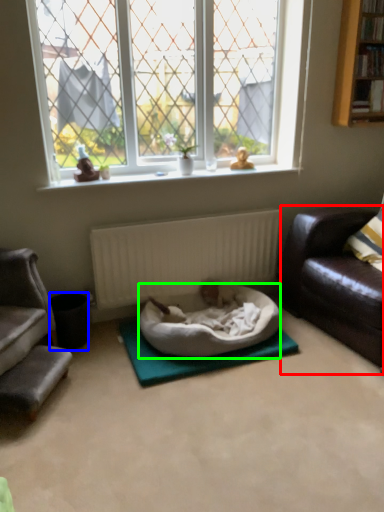
Question: Considering the real-world distances, which object is closest to studio couch (highlighted by a red box)? trash bin/can (highlighted by a blue box) or dog bed (highlighted by a green box).

Choices:
 (A) trash bin/can
 (B) dog bed

Answer: (B)